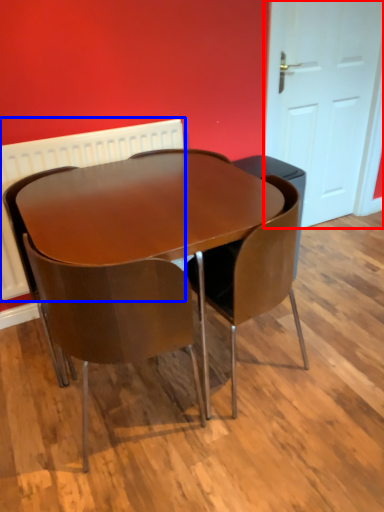
Question: Which of the following is the farthest to the observer, door (highlighted by a red box) or radiator (highlighted by a blue box)?

Choices:
 (A) door
 (B) radiator

Answer: (A)